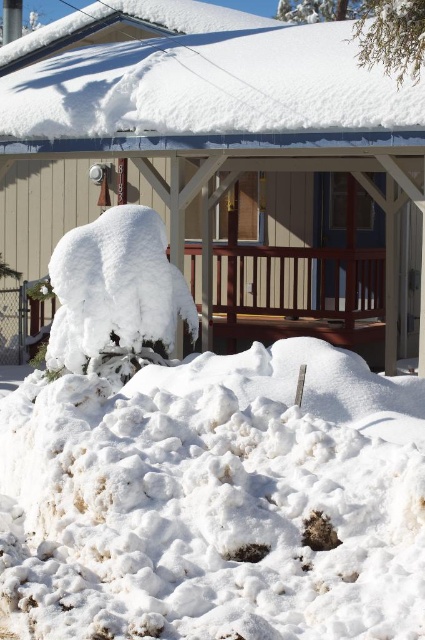
You are standing in front of the house and notice two areas of white fluffy snow. One is at the lower center and the other at the center. Which direction should you walk to move from the white fluffy snow at center to the white fluffy snow at lower center?

You should walk to the right to move from the white fluffy snow at center to the white fluffy snow at lower center since the white fluffy snow at lower center is to the right of white fluffy snow at center.

You are a delivery person trying to reach the mailbox mounted on the wall near the entrance of the house. You see two areas of white fluffy snow at lower center and white fluffy snow at center in your path. Which area of snow should you avoid stepping on to reach the mailbox safely?

You should avoid stepping on the white fluffy snow at center because the white fluffy snow at lower center is positioned under it, meaning the lower center snow is closer to the mailbox and stepping on the center snow might be deeper or obstruct the path.

You are standing at the entrance of the house and want to place a small garden ornament exactly at the coordinates mentioned in the scene. Where should you place the ornament relative to the white fluffy snow at lower center?

The white fluffy snow at lower center is located at point (215, 500), so you should place the ornament at those exact coordinates relative to it.